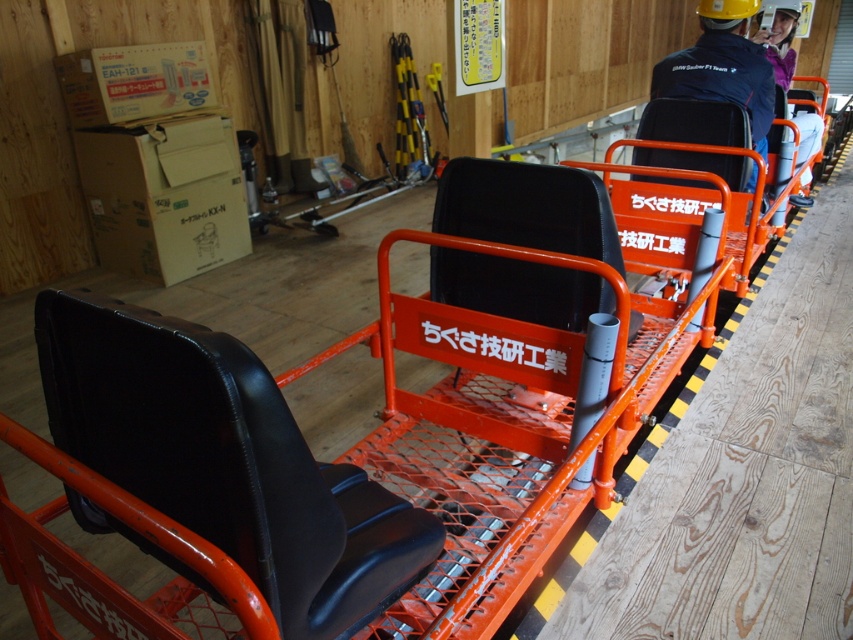
You are an employee in the workshop and need to access both the black leather jacket at upper right and the purple fleece jacket at upper right. Which jacket should you reach for first to grab the one closer to you?

The black leather jacket at upper right is closer to the viewer than the purple fleece jacket at upper right, so you should reach for the black leather jacket at upper right first.

You are an employee in the workshop and need to hang both the black leather jacket at upper right and the purple fleece jacket at upper right on a coat rack that can only hold items up to 1 meter in width. Which jacket will fit better on the coat rack?

The black leather jacket at upper right has a smaller width than the purple fleece jacket at upper right, so it will fit better on the coat rack that can only hold items up to 1 meter in width.

You are an employee in the workshop and need to retrieve the purple fleece jacket at upper right. You are currently standing next to the black leather seat at center. Which direction should you move to reach the jacket?

The purple fleece jacket at upper right is above the black leather seat at center, so you should move upward to reach it.